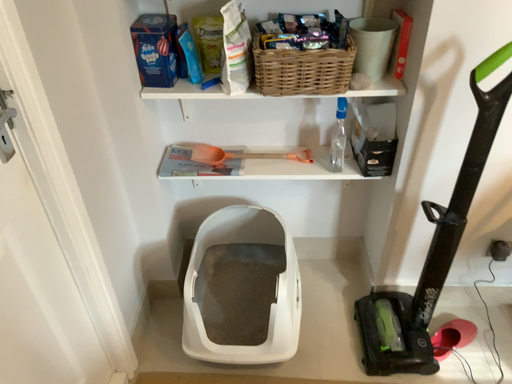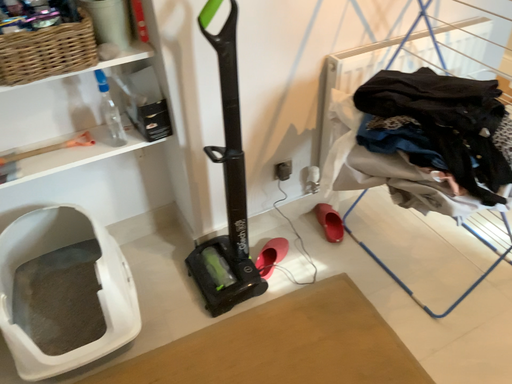
Question: Which way did the camera rotate in the video?

Choices:
 (A) rotated right
 (B) rotated left

Answer: (A)